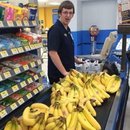
Locate an element on the screen. The width and height of the screenshot is (130, 130). walls is located at coordinates (48, 17), (89, 12), (75, 24).